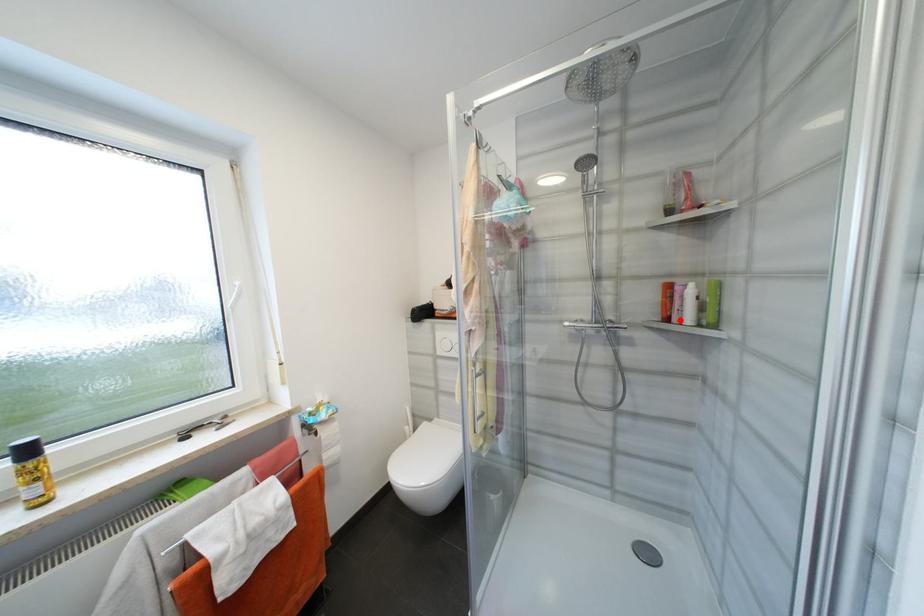
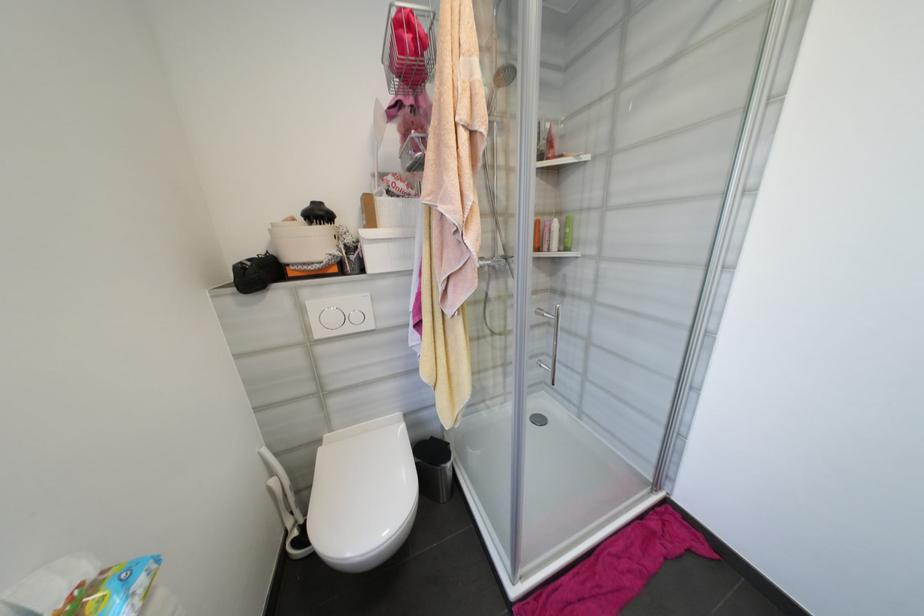
Locate, in the second image, the point that corresponds to the highlighted location in the first image.

(551, 249)